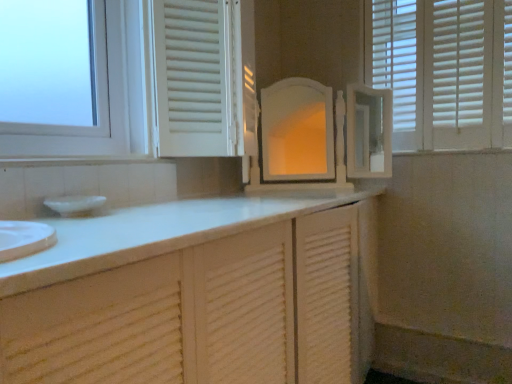
What do you see at coordinates (78, 160) in the screenshot? I see `white glossy window sill at upper left` at bounding box center [78, 160].

Locate an element on the screen. white glossy window sill at upper left is located at coordinates (78, 160).

Describe the element at coordinates (443, 71) in the screenshot. The image size is (512, 384). I see `white matte blinds at upper right` at that location.

The image size is (512, 384). I want to click on white matte blinds at upper right, so click(x=443, y=71).

Measure the distance between white matte blinds at upper right and camera.

white matte blinds at upper right and camera are 5.84 feet apart from each other.

Identify the location of white glossy window sill at upper left. The width and height of the screenshot is (512, 384). pyautogui.click(x=78, y=160).

Between white matte blinds at upper right and white glossy window sill at upper left, which one appears on the left side from the viewer's perspective?

Positioned to the left is white glossy window sill at upper left.

Looking at this image, does white matte blinds at upper right come behind white glossy window sill at upper left?

Yes.

Is point (399, 106) closer to camera compared to point (3, 166)?

No, (399, 106) is further to viewer.

From the image's perspective, would you say white matte blinds at upper right is positioned over white glossy window sill at upper left?

Yes, from the image's perspective, white matte blinds at upper right is above white glossy window sill at upper left.

From a real-world perspective, is white matte blinds at upper right below white glossy window sill at upper left?

No.

Looking at their sizes, would you say white matte blinds at upper right is wider or thinner than white glossy window sill at upper left?

Considering their sizes, white matte blinds at upper right looks slimmer than white glossy window sill at upper left.

Is white matte blinds at upper right taller or shorter than white glossy window sill at upper left?

Considering their sizes, white matte blinds at upper right has more height than white glossy window sill at upper left.

Who is bigger, white matte blinds at upper right or white glossy window sill at upper left?

Bigger between the two is white matte blinds at upper right.

Could white glossy window sill at upper left be considered to be inside white matte blinds at upper right?

No, white glossy window sill at upper left is located outside of white matte blinds at upper right.

Is white matte blinds at upper right next to white glossy window sill at upper left?

They are not placed beside each other.

Is white glossy window sill at upper left at the back of white matte blinds at upper right?

No, white glossy window sill at upper left is not at the back of white matte blinds at upper right.

Based on the photo, what's the angular difference between white matte blinds at upper right and white glossy window sill at upper left's facing directions?

The angular difference between white matte blinds at upper right and white glossy window sill at upper left is 90 degrees.

Measure the distance from white matte blinds at upper right to white glossy window sill at upper left.

white matte blinds at upper right and white glossy window sill at upper left are 1.36 meters apart.

Identify the location of window located above the white glossy window sill at upper left (from a real-world perspective). The image size is (512, 384). (443, 71).

Is white glossy window sill at upper left to the left of white matte blinds at upper right from the viewer's perspective?

Indeed, white glossy window sill at upper left is positioned on the left side of white matte blinds at upper right.

Considering the positions of objects white glossy window sill at upper left and white matte blinds at upper right in the image provided, who is in front, white glossy window sill at upper left or white matte blinds at upper right?

white glossy window sill at upper left.

In the scene shown: Which is less distant, (101, 155) or (393, 66)?

Point (101, 155) is positioned closer to the camera compared to point (393, 66).

From the image's perspective, relative to white matte blinds at upper right, is white glossy window sill at upper left above or below?

From the image's perspective, white glossy window sill at upper left appears below white matte blinds at upper right.

Looking at this image, from a real-world perspective, who is located lower, white glossy window sill at upper left or white matte blinds at upper right?

white glossy window sill at upper left is physically lower.

Is white glossy window sill at upper left wider than white matte blinds at upper right?

Indeed, white glossy window sill at upper left has a greater width compared to white matte blinds at upper right.

Considering the sizes of objects white glossy window sill at upper left and white matte blinds at upper right in the image provided, who is taller, white glossy window sill at upper left or white matte blinds at upper right?

white matte blinds at upper right.

Which of these two, white glossy window sill at upper left or white matte blinds at upper right, is bigger?

white matte blinds at upper right is bigger.

Is white glossy window sill at upper left not within white matte blinds at upper right?

Yes, white glossy window sill at upper left is outside of white matte blinds at upper right.

Is white glossy window sill at upper left placed right next to white matte blinds at upper right?

No, white glossy window sill at upper left is not next to white matte blinds at upper right.

Could you tell me if white glossy window sill at upper left is facing white matte blinds at upper right?

No, white glossy window sill at upper left is not oriented towards white matte blinds at upper right.

How different are the orientations of white glossy window sill at upper left and white matte blinds at upper right in degrees?

The angle between the facing direction of white glossy window sill at upper left and the facing direction of white matte blinds at upper right is 90 degrees.

At what (x,y) coordinates should I click in order to perform the action: click on window sill lying on the left of white matte blinds at upper right. Please return your answer as a coordinate pair (x, y). This screenshot has height=384, width=512. Looking at the image, I should click on (78, 160).

Where is `window sill in front of the white matte blinds at upper right`? This screenshot has height=384, width=512. window sill in front of the white matte blinds at upper right is located at coordinates (78, 160).

The image size is (512, 384). I want to click on window sill located underneath the white matte blinds at upper right (from a real-world perspective), so click(78, 160).